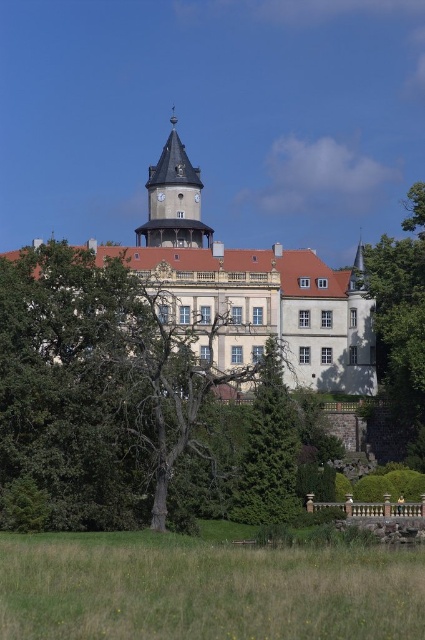
Based on the photo, you are standing in front of the historic building and want to determine the relative positions of two points marked on the structure. Which of the two points, point 1 at coordinates point (71, 602) or point 2 at coordinates point (283, 484), is closer to you?

Point 1 at coordinates point (71, 602) is closer to the viewer than point 2 at coordinates point (283, 484).

Based on the photo, you are standing in front of a historic building and notice the green grass at lower center and the green textured tree at center. Which object is closer to the ground?

The green grass at lower center is closer to the ground as it is positioned below the green textured tree at center.

You are standing in front of the historic building and want to take a photo that includes both the green leafy tree at right and the matte gray clock tower at center. Which object will appear larger in the photo?

The green leafy tree at right will appear larger in the photo because it is much taller than the matte gray clock tower at center.